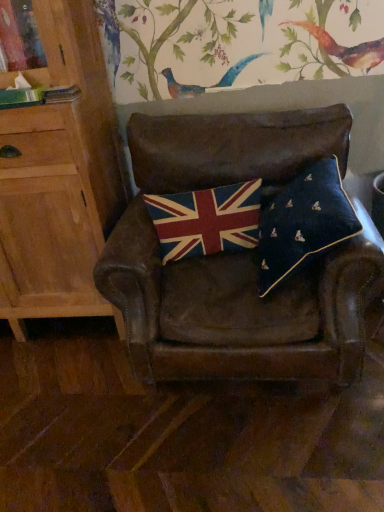
Question: Can you confirm if textured woolen flag at center is wider than navy velvet pillow at center?

Choices:
 (A) no
 (B) yes

Answer: (A)

Question: Is textured woolen flag at center not close to navy velvet pillow at center?

Choices:
 (A) yes
 (B) no

Answer: (B)

Question: Does textured woolen flag at center turn towards navy velvet pillow at center?

Choices:
 (A) yes
 (B) no

Answer: (B)

Question: Is textured woolen flag at center bigger than navy velvet pillow at center?

Choices:
 (A) no
 (B) yes

Answer: (A)

Question: Is textured woolen flag at center next to navy velvet pillow at center and touching it?

Choices:
 (A) no
 (B) yes

Answer: (A)

Question: From a real-world perspective, is textured woolen flag at center positioned above or below light wood cabinet at left?

Choices:
 (A) above
 (B) below

Answer: (B)

Question: Considering the relative positions of textured woolen flag at center and light wood cabinet at left in the image provided, is textured woolen flag at center to the left or to the right of light wood cabinet at left?

Choices:
 (A) left
 (B) right

Answer: (B)

Question: In terms of width, does textured woolen flag at center look wider or thinner when compared to light wood cabinet at left?

Choices:
 (A) wide
 (B) thin

Answer: (B)

Question: Does point (196, 247) appear closer or farther from the camera than point (1, 285)?

Choices:
 (A) closer
 (B) farther

Answer: (A)

Question: Considering the positions of point [34, 135] and point [311, 167], is point [34, 135] closer or farther from the camera than point [311, 167]?

Choices:
 (A) closer
 (B) farther

Answer: (A)

Question: Considering their positions, is light wood cabinet at left located in front of or behind navy velvet pillow at center?

Choices:
 (A) front
 (B) behind

Answer: (B)

Question: Is light wood cabinet at left spatially inside navy velvet pillow at center, or outside of it?

Choices:
 (A) outside
 (B) inside

Answer: (A)

Question: In terms of size, does light wood cabinet at left appear bigger or smaller than navy velvet pillow at center?

Choices:
 (A) big
 (B) small

Answer: (A)

Question: Considering the positions of textured woolen flag at center and leather chair at center in the image, is textured woolen flag at center bigger or smaller than leather chair at center?

Choices:
 (A) small
 (B) big

Answer: (A)

Question: Is textured woolen flag at center wider or thinner than leather chair at center?

Choices:
 (A) wide
 (B) thin

Answer: (B)